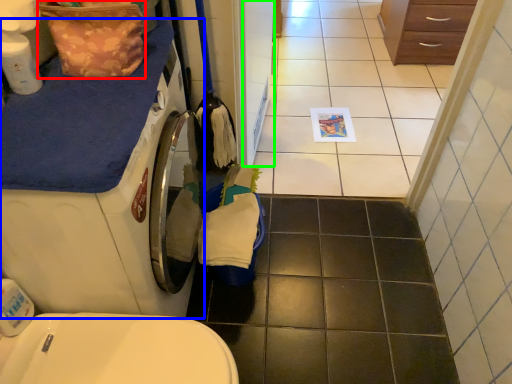
Question: Which object is the farthest from material (highlighted by a red box)? Choose among these: washing machine (highlighted by a blue box) or screen door (highlighted by a green box).

Choices:
 (A) washing machine
 (B) screen door

Answer: (B)